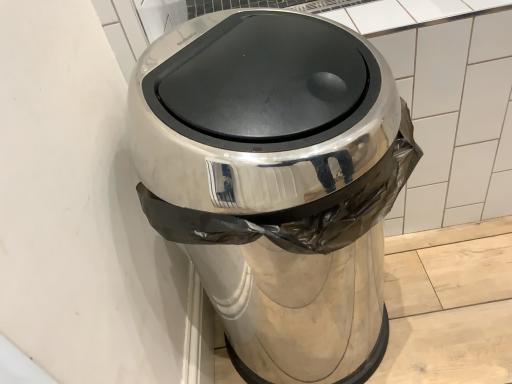
Describe the element at coordinates (276, 182) in the screenshot. I see `polished stainless steel trash can at center` at that location.

Locate an element on the screen. polished stainless steel trash can at center is located at coordinates (276, 182).

The height and width of the screenshot is (384, 512). In order to click on polished stainless steel trash can at center in this screenshot , I will do `click(276, 182)`.